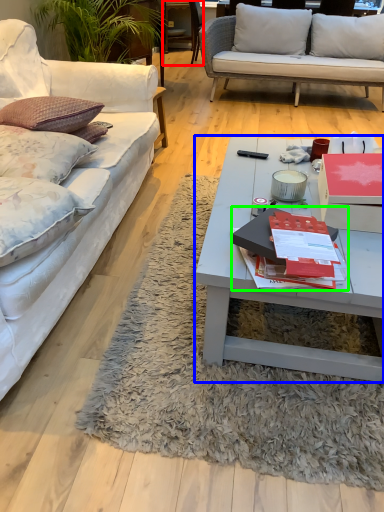
Question: Based on their relative distances, which object is farther from chair (highlighted by a red box)? Choose from coffee table (highlighted by a blue box) and book (highlighted by a green box).

Choices:
 (A) coffee table
 (B) book

Answer: (B)